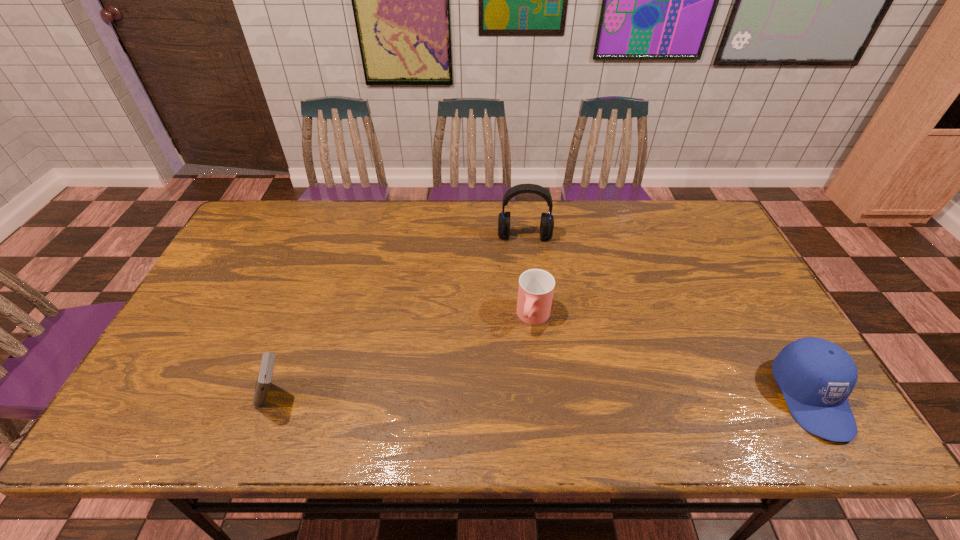
Point out which object is positioned as the nearest to the rightmost object. Please provide its 2D coordinates. Your answer should be formatted as a tuple, i.e. [(x, y)], where the tuple contains the x and y coordinates of a point satisfying the conditions above.

[(536, 287)]

At what (x,y) coordinates should I click in order to perform the action: click on the second closest object to the headset. Please return your answer as a coordinate pair (x, y). Image resolution: width=960 pixels, height=540 pixels. Looking at the image, I should click on 816,376.

Identify the location of free location that satisfies the following two spatial constraints: 1. on the front side of the second farthest object; 2. on the right side of the farthest object. Image resolution: width=960 pixels, height=540 pixels. (534, 317).

At what (x,y) coordinates should I click in order to perform the action: click on vacant position in the image that satisfies the following two spatial constraints: 1. on the front side of the tallest object; 2. on the right side of the third nearest object. Please return your answer as a coordinate pair (x, y). Looking at the image, I should click on (534, 317).